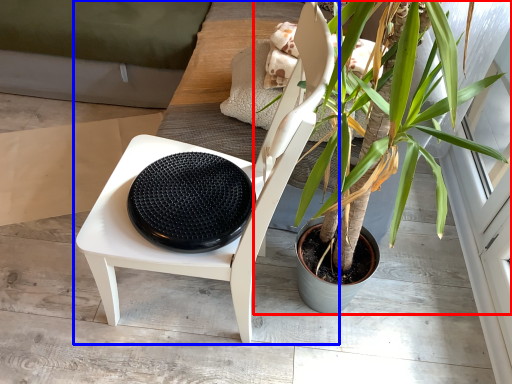
Question: Which object is further to the camera taking this photo, houseplant (highlighted by a red box) or chair (highlighted by a blue box)?

Choices:
 (A) houseplant
 (B) chair

Answer: (A)